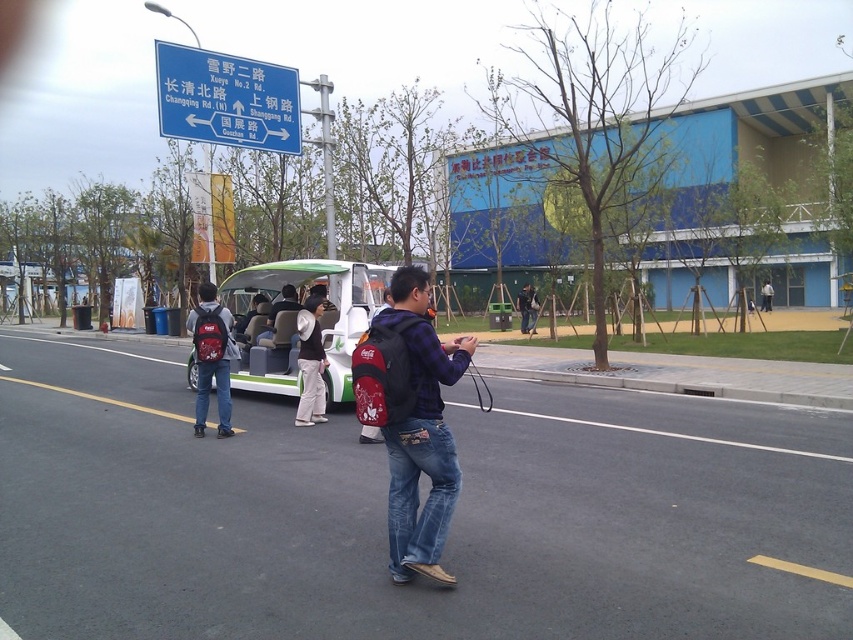
Is blue plastic sign at upper center taller than denim jacket at center?

Yes, blue plastic sign at upper center is taller than denim jacket at center.

You are a GUI agent. You are given a task and a screenshot of the screen. Output one action in this format:
    pyautogui.click(x=<x>, y=<y>)
    Task: Click on the blue plastic sign at upper center
    The image size is (853, 640).
    Given the screenshot: What is the action you would take?
    pyautogui.click(x=225, y=99)

Find the location of a particular element. The width and height of the screenshot is (853, 640). blue plastic sign at upper center is located at coordinates (225, 99).

The image size is (853, 640). What are the coordinates of `green matte bus at center` in the screenshot? It's located at (323, 310).

Describe the element at coordinates (323, 310) in the screenshot. This screenshot has height=640, width=853. I see `green matte bus at center` at that location.

Identify the location of green matte bus at center. (323, 310).

Looking at this image, how far apart are blue plastic sign at upper center and white cotton hat at center?

blue plastic sign at upper center and white cotton hat at center are 7.66 meters apart from each other.

Which is more to the right, blue plastic sign at upper center or white cotton hat at center?

Positioned to the right is white cotton hat at center.

The width and height of the screenshot is (853, 640). Identify the location of blue plastic sign at upper center. (225, 99).